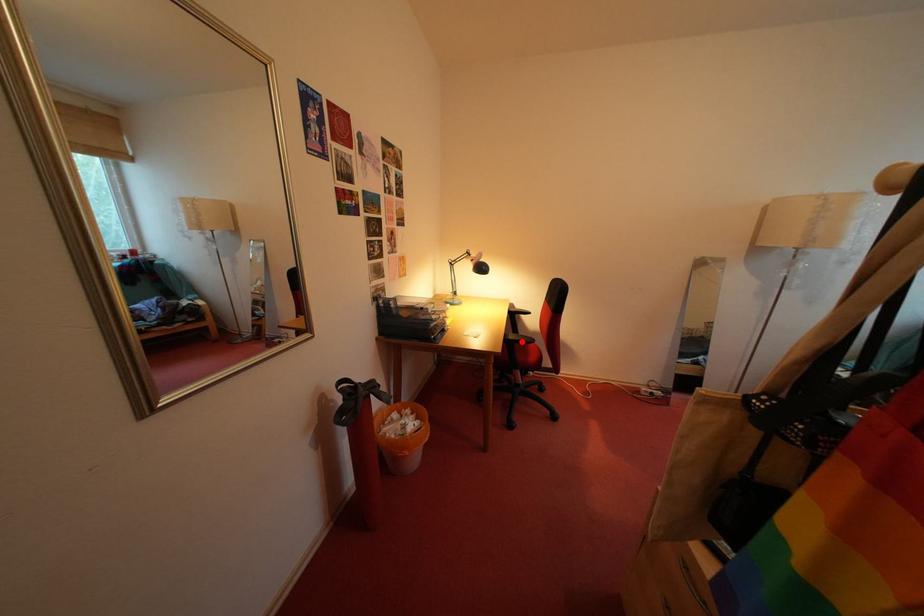
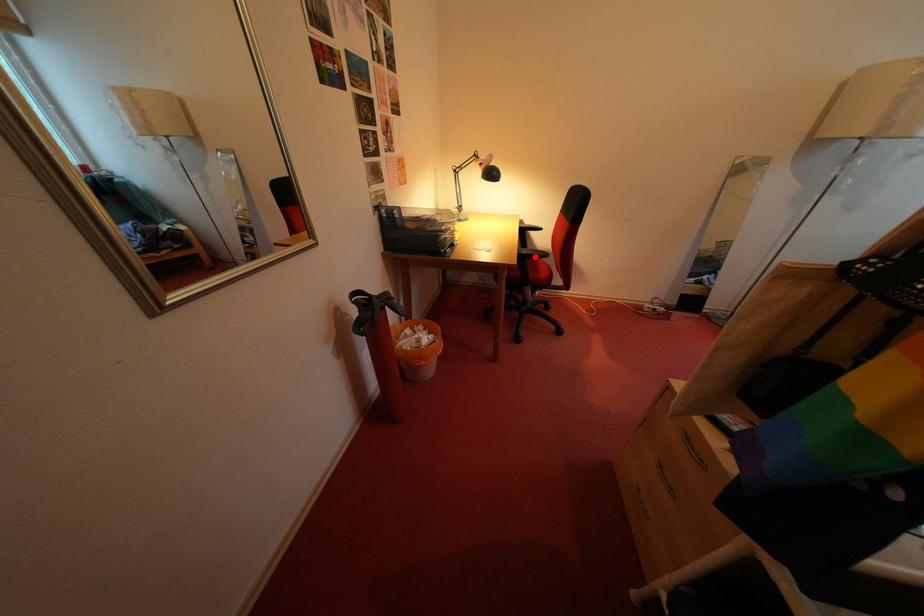
I am providing you with two images of the same scene from different viewpoints. A red point is marked on the first image and another point is marked on the second image. Are the points marked in image1 and image2 representing the same 3D position?

Yes